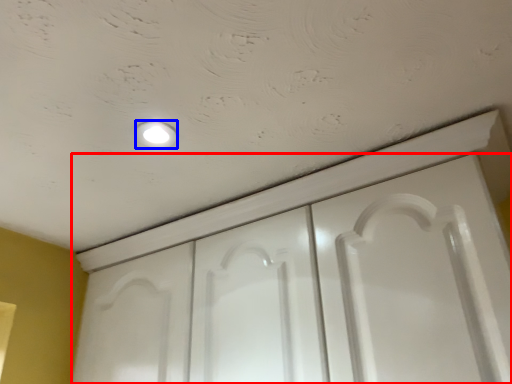
Question: Which point is further to the camera, door (highlighted by a red box) or dot (highlighted by a blue box)?

Choices:
 (A) door
 (B) dot

Answer: (B)